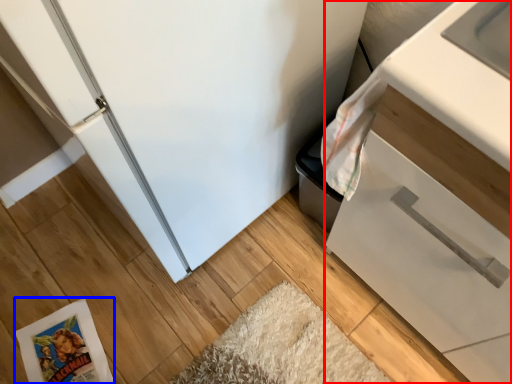
Question: Among these objects, which one is nearest to the camera, cabinetry (highlighted by a red box) or comic book (highlighted by a blue box)?

Choices:
 (A) cabinetry
 (B) comic book

Answer: (A)